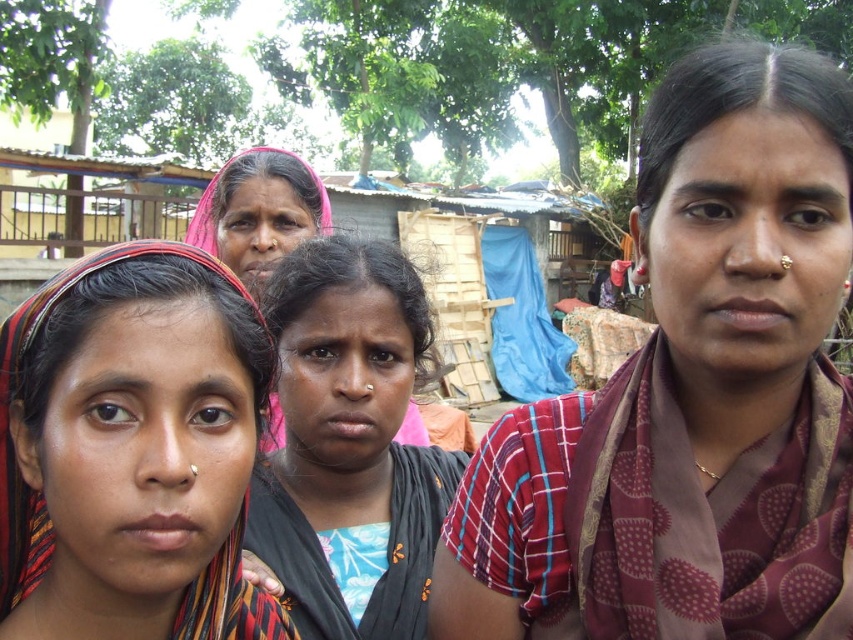
You are a photographer trying to capture the maroon printed saree at center and the pink fabric headscarf at center in the same frame. Which object should you focus on first to ensure both are in the shot?

The maroon printed saree at center is located below the pink fabric headscarf at center, so you should focus on the pink fabric headscarf at center first to ensure both are in the frame.

You are a photographer trying to capture a detailed shot of the black fabric at center and the pink fabric headscarf at center. Which fabric is located beneath the other in the image?

The black fabric at center is positioned under the pink fabric headscarf at center.